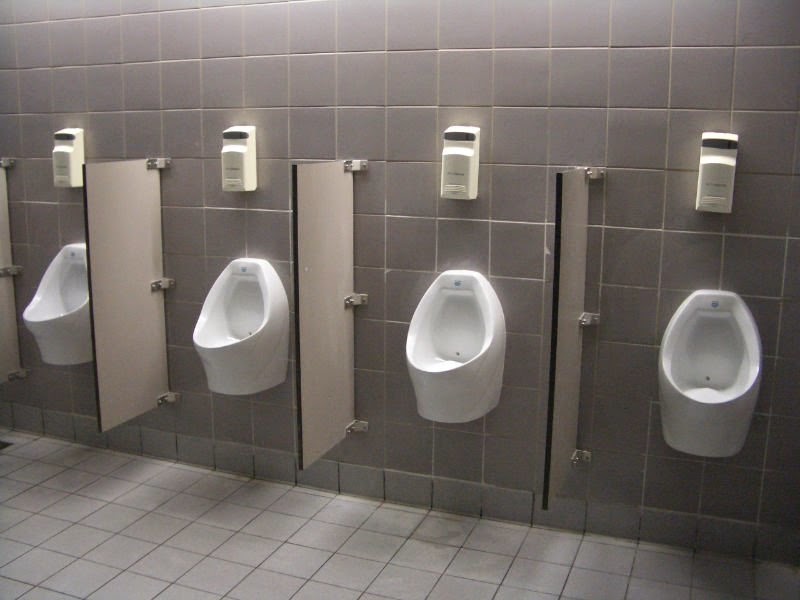
Where is `deviders`? This screenshot has width=800, height=600. deviders is located at coordinates (556, 336), (308, 328), (130, 319), (4, 313).